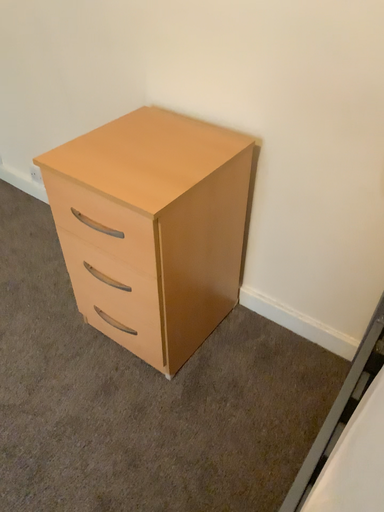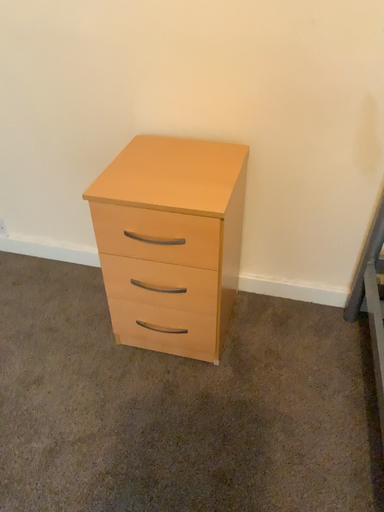
Question: How did the camera likely rotate when shooting the video?

Choices:
 (A) rotated left
 (B) rotated right

Answer: (B)